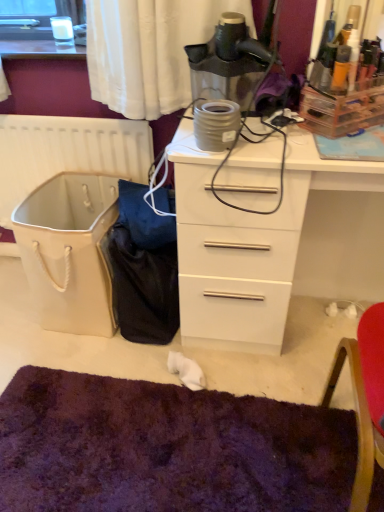
Question: Is purple shaggy mat at lower center bigger than white plastic radiator at left?

Choices:
 (A) yes
 (B) no

Answer: (A)

Question: Considering the relative positions of purple shaggy mat at lower center and white plastic radiator at left in the image provided, is purple shaggy mat at lower center to the right of white plastic radiator at left from the viewer's perspective?

Choices:
 (A) yes
 (B) no

Answer: (A)

Question: From a real-world perspective, is purple shaggy mat at lower center below white plastic radiator at left?

Choices:
 (A) no
 (B) yes

Answer: (B)

Question: Would you say purple shaggy mat at lower center is outside white plastic radiator at left?

Choices:
 (A) no
 (B) yes

Answer: (B)

Question: Is purple shaggy mat at lower center facing away from white plastic radiator at left?

Choices:
 (A) no
 (B) yes

Answer: (A)

Question: Based on their sizes in the image, would you say white plastic chair at right is bigger or smaller than white glossy chest of drawers at center?

Choices:
 (A) small
 (B) big

Answer: (A)

Question: From the image's perspective, is white plastic chair at right above or below white glossy chest of drawers at center?

Choices:
 (A) below
 (B) above

Answer: (A)

Question: In terms of width, does white plastic chair at right look wider or thinner when compared to white glossy chest of drawers at center?

Choices:
 (A) wide
 (B) thin

Answer: (A)

Question: In the image, is white plastic chair at right positioned in front of or behind white glossy chest of drawers at center?

Choices:
 (A) behind
 (B) front

Answer: (B)

Question: Is point (231, 31) closer or farther from the camera than point (134, 153)?

Choices:
 (A) farther
 (B) closer

Answer: (B)

Question: From the image's perspective, relative to white plastic radiator at left, is matte black hairdryer at upper center above or below?

Choices:
 (A) below
 (B) above

Answer: (B)

Question: From a real-world perspective, is matte black hairdryer at upper center positioned above or below white plastic radiator at left?

Choices:
 (A) above
 (B) below

Answer: (A)

Question: Based on their sizes in the image, would you say matte black hairdryer at upper center is bigger or smaller than white plastic radiator at left?

Choices:
 (A) big
 (B) small

Answer: (B)

Question: From the image's perspective, is white plastic radiator at left located above or below matte black hairdryer at upper center?

Choices:
 (A) above
 (B) below

Answer: (B)

Question: From a real-world perspective, is white plastic radiator at left above or below matte black hairdryer at upper center?

Choices:
 (A) above
 (B) below

Answer: (B)